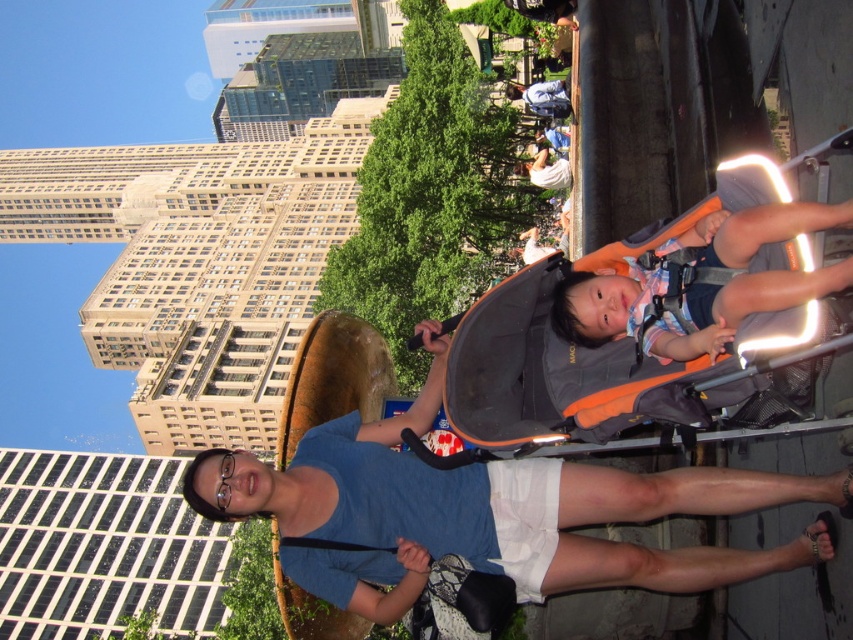
Which is in front, point (828, 152) or point (685, 296)?

Positioned in front is point (828, 152).

Consider the image. Which of these two, orange fabric baby carriage at center or matte orange baby carrier at center, stands taller?

Standing taller between the two is orange fabric baby carriage at center.

Who is more distant from viewer, (x=721, y=195) or (x=723, y=256)?

Point (x=721, y=195)

This screenshot has width=853, height=640. What are the coordinates of `orange fabric baby carriage at center` in the screenshot? It's located at tap(593, 352).

Who is more forward, (331, 422) or (764, 312)?

Point (764, 312) is in front.

Can you confirm if blue fabric shirt at center is positioned below orange fabric baby carriage at center?

Correct, blue fabric shirt at center is located below orange fabric baby carriage at center.

Does point (306, 572) come behind point (747, 337)?

Yes.

Identify the location of blue fabric shirt at center. (488, 513).

Does point (689, 586) lie in front of point (828, 266)?

No, it is behind (828, 266).

This screenshot has width=853, height=640. What are the coordinates of `blue fabric shirt at center` in the screenshot? It's located at (488, 513).

Does point (375, 550) lie behind point (695, 269)?

Yes.

Find the location of a particular element. This screenshot has width=853, height=640. blue fabric shirt at center is located at coordinates (488, 513).